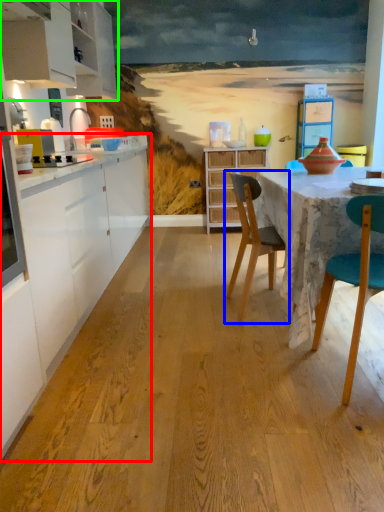
Question: Based on their relative distances, which object is nearer to countertop (highlighted by a red box)? Choose from chair (highlighted by a blue box) and cabinetry (highlighted by a green box).

Choices:
 (A) chair
 (B) cabinetry

Answer: (A)